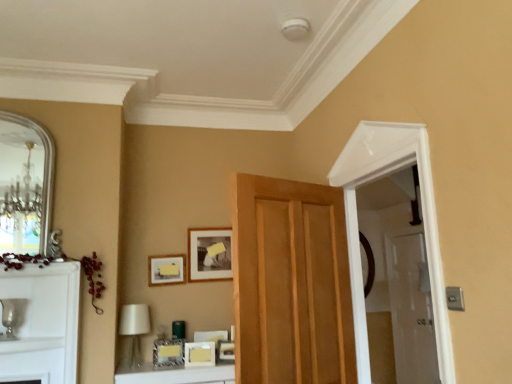
Question: Choose the correct answer: Is wooden door at center inside matte gold picture frame at center, the 4th picture frame positioned from the back, or outside it?

Choices:
 (A) outside
 (B) inside

Answer: (A)

Question: Considering the positions of point (338, 329) and point (153, 354), is point (338, 329) closer or farther from the camera than point (153, 354)?

Choices:
 (A) farther
 (B) closer

Answer: (B)

Question: Which of these objects is positioned farthest from the matte gold picture frame at center, the third picture frame when ordered from back to front?

Choices:
 (A) clear glass door at right
 (B) silver metallic mirror at left
 (C) matte gold picture frame at center, the 2th picture frame from the front
 (D) matte black picture frame at upper center, positioned as the 1th picture frame in back-to-front order
 (E) wooden door at center

Answer: (A)

Question: Estimate the real-world distances between objects in this image. Which object is farther from the silver metallic mirror at left?

Choices:
 (A) matte gold picture frame at center, the first picture frame when ordered from front to back
 (B) wooden door at center
 (C) matte gold picture frame at upper center, marked as the second picture frame in a back-to-front arrangement
 (D) matte black picture frame at upper center, positioned as the 1th picture frame in back-to-front order
 (E) white fabric lampshade at lower left

Answer: (B)